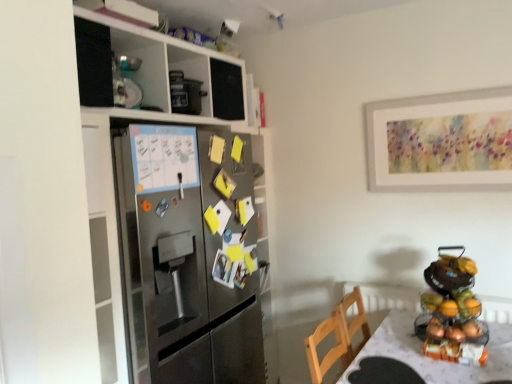
Describe the element at coordinates (179, 208) in the screenshot. I see `stainless steel refrigerator at left` at that location.

Measure the distance between point (436, 295) and camera.

A distance of 1.94 meters exists between point (436, 295) and camera.

I want to click on white textured table at lower right, so click(x=434, y=359).

The height and width of the screenshot is (384, 512). Find the location of `shiny metallic fruit basket at right`. shiny metallic fruit basket at right is located at coordinates (452, 304).

Is point (453, 304) positioned behind point (471, 294)?

No, it is in front of (471, 294).

Which is more to the left, shiny metallic fruit basket at right or metallic fruit stand at right?

Positioned to the left is metallic fruit stand at right.

From a real-world perspective, which is physically below, shiny metallic fruit basket at right or metallic fruit stand at right?

In real-world perspective, shiny metallic fruit basket at right is lower.

Considering the positions of objects white textured table at lower right and metallic fruit stand at right in the image provided, who is more to the left, white textured table at lower right or metallic fruit stand at right?

Positioned to the left is white textured table at lower right.

Is the position of white textured table at lower right less distant than that of metallic fruit stand at right?

Yes, it is in front of metallic fruit stand at right.

Considering the sizes of objects white textured table at lower right and metallic fruit stand at right in the image provided, who is taller, white textured table at lower right or metallic fruit stand at right?

With more height is white textured table at lower right.

Which of these two, metallic fruit stand at right or shiny metallic fruit basket at right, stands shorter?

shiny metallic fruit basket at right is shorter.

Consider the image. Is shiny metallic fruit basket at right surrounded by metallic fruit stand at right?

That's correct, shiny metallic fruit basket at right is inside metallic fruit stand at right.

From the image's perspective, is metallic fruit stand at right beneath shiny metallic fruit basket at right?

No, from the image's perspective, metallic fruit stand at right is not beneath shiny metallic fruit basket at right.

Which is behind, point (454, 318) or point (431, 304)?

Point (431, 304)

Which is closer, [449,306] or [510,343]?

The point [510,343] is closer.

Is white textured table at lower right a part of shiny metallic fruit basket at right?

No, white textured table at lower right is not inside shiny metallic fruit basket at right.

Which of these two, shiny metallic fruit basket at right or white textured table at lower right, stands shorter?

With less height is shiny metallic fruit basket at right.

At what (x,y) coordinates should I click in order to perform the action: click on desk below the stainless steel refrigerator at left (from the image's perspective). Please return your answer as a coordinate pair (x, y). The image size is (512, 384). Looking at the image, I should click on (434, 359).

Is point (214, 354) positioned in front of point (477, 377)?

No, it is not.

Based on the photo, is stainless steel refrigerator at left in front of white textured table at lower right?

That is False.

Is stainless steel refrigerator at left to the right of white textured table at lower right from the viewer's perspective?

No.

From a real-world perspective, is shiny metallic fruit basket at right above or below stainless steel refrigerator at left?

shiny metallic fruit basket at right is situated lower than stainless steel refrigerator at left in the real world.

Between point (461, 307) and point (144, 110), which one is positioned behind?

The point (144, 110) is farther from the camera.

Who is taller, shiny metallic fruit basket at right or stainless steel refrigerator at left?

Standing taller between the two is stainless steel refrigerator at left.

Which object is further away from the camera taking this photo, shiny metallic fruit basket at right or stainless steel refrigerator at left?

Positioned behind is shiny metallic fruit basket at right.

Which object is positioned more to the right, stainless steel refrigerator at left or metallic fruit stand at right?

metallic fruit stand at right is more to the right.

Which object is more forward, stainless steel refrigerator at left or metallic fruit stand at right?

stainless steel refrigerator at left is closer to the camera.

From the image's perspective, relative to metallic fruit stand at right, is stainless steel refrigerator at left above or below?

stainless steel refrigerator at left is above metallic fruit stand at right.

Is stainless steel refrigerator at left facing towards metallic fruit stand at right?

Yes.

At what (x,y) coordinates should I click in order to perform the action: click on fruit that appears below the metallic fruit stand at right (from the image's perspective). Please return your answer as a coordinate pair (x, y). The height and width of the screenshot is (384, 512). Looking at the image, I should click on (452, 304).

This screenshot has height=384, width=512. I want to click on desk lying in front of the metallic fruit stand at right, so click(x=434, y=359).

Considering their positions, is stainless steel refrigerator at left positioned closer to white textured table at lower right than metallic fruit stand at right?

metallic fruit stand at right lies closer to white textured table at lower right than the other object.

Based on their spatial positions, is stainless steel refrigerator at left or metallic fruit stand at right further from shiny metallic fruit basket at right?

Among the two, stainless steel refrigerator at left is located further to shiny metallic fruit basket at right.

Looking at the image, which one is located further to shiny metallic fruit basket at right, white textured table at lower right or metallic fruit stand at right?

white textured table at lower right.

Which object lies nearer to the anchor point metallic fruit stand at right, shiny metallic fruit basket at right or stainless steel refrigerator at left?

The object closer to metallic fruit stand at right is shiny metallic fruit basket at right.

Considering their positions, is stainless steel refrigerator at left positioned closer to metallic fruit stand at right than white textured table at lower right?

Based on the image, white textured table at lower right appears to be nearer to metallic fruit stand at right.

Based on their spatial positions, is white textured table at lower right or stainless steel refrigerator at left further from shiny metallic fruit basket at right?

stainless steel refrigerator at left is further to shiny metallic fruit basket at right.

When comparing their distances from metallic fruit stand at right, does stainless steel refrigerator at left or shiny metallic fruit basket at right seem further?

stainless steel refrigerator at left is further to metallic fruit stand at right.

Based on their spatial positions, is metallic fruit stand at right or stainless steel refrigerator at left further from shiny metallic fruit basket at right?

Based on the image, stainless steel refrigerator at left appears to be further to shiny metallic fruit basket at right.

Locate an element on the screen. desk between stainless steel refrigerator at left and metallic fruit stand at right in the horizontal direction is located at coordinates (434, 359).

Locate an element on the screen. appliance located between stainless steel refrigerator at left and shiny metallic fruit basket at right in the left-right direction is located at coordinates (451, 310).

At what (x,y) coordinates should I click in order to perform the action: click on desk situated between stainless steel refrigerator at left and shiny metallic fruit basket at right from left to right. Please return your answer as a coordinate pair (x, y). Image resolution: width=512 pixels, height=384 pixels. Looking at the image, I should click on (434, 359).

Locate an element on the screen. The width and height of the screenshot is (512, 384). appliance located between white textured table at lower right and shiny metallic fruit basket at right in the depth direction is located at coordinates (451, 310).